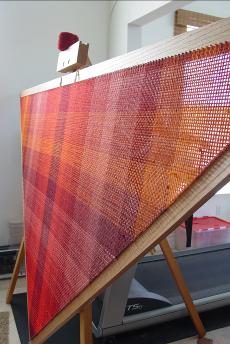
Locate an element on the screen. The width and height of the screenshot is (230, 344). wooden stand legs is located at coordinates (86, 326), (16, 273), (183, 279), (151, 252).